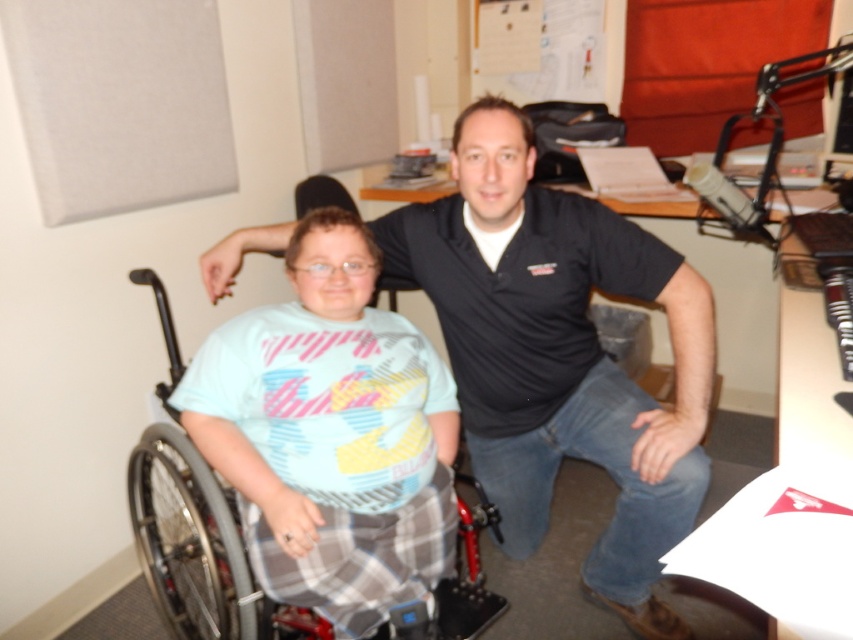
Can you confirm if black smooth shirt at center is positioned to the right of gray plastic wheelchair at left?

Correct, you'll find black smooth shirt at center to the right of gray plastic wheelchair at left.

I want to click on black smooth shirt at center, so click(560, 355).